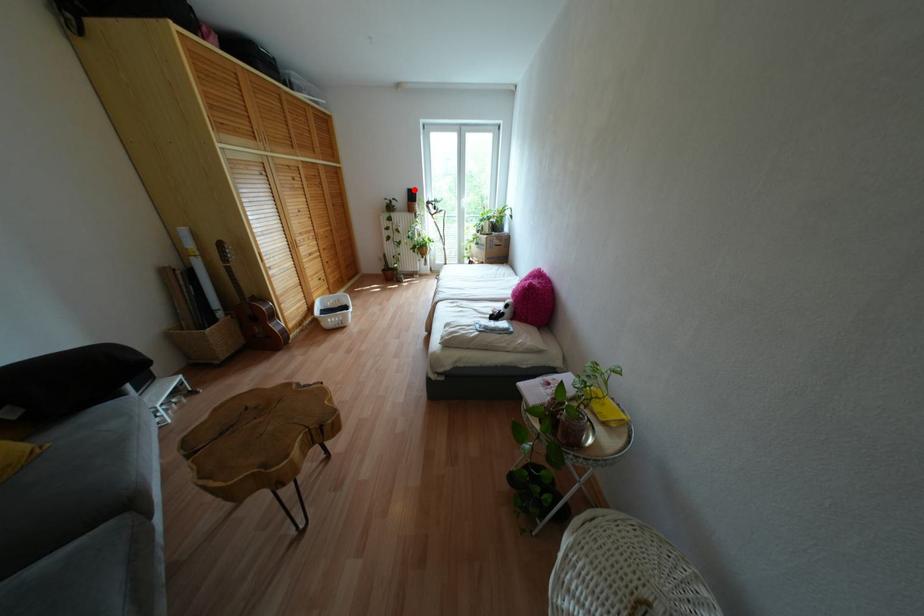
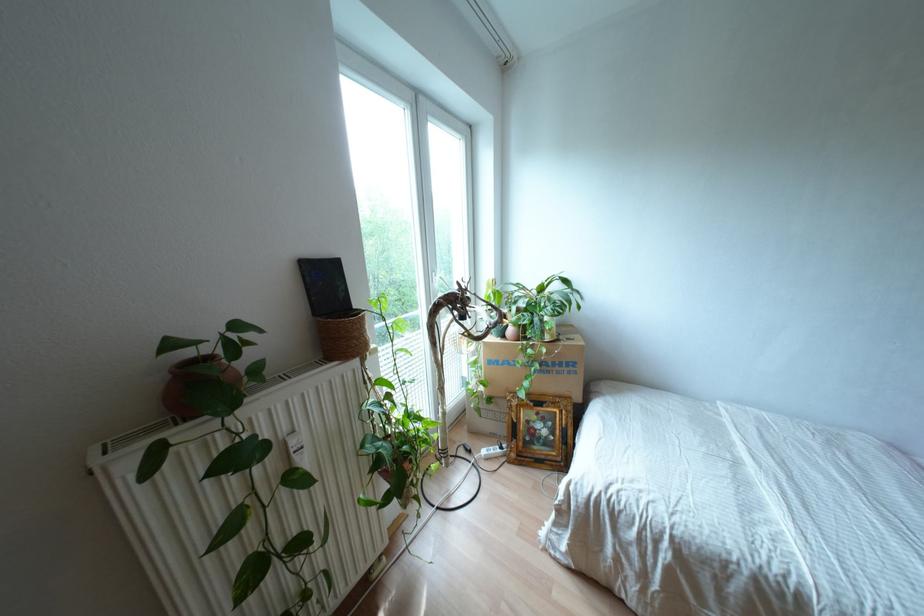
Where in the second image is the point corresponding to the highlighted location from the first image?

(334, 262)